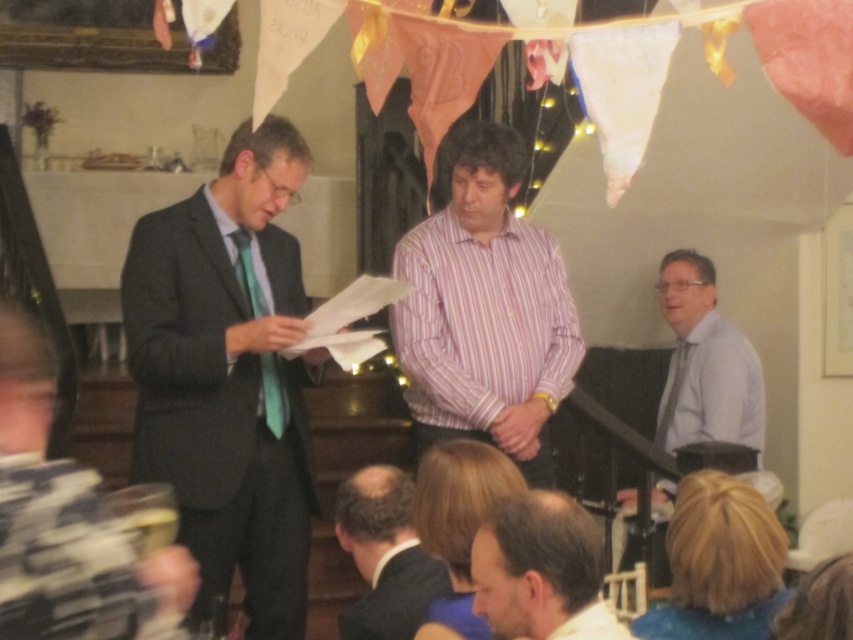
Question: Is dark gray suit at left to the left of matte white shirt at right from the viewer's perspective?

Choices:
 (A) no
 (B) yes

Answer: (B)

Question: Which object is the farthest from the dark brown hair at center?

Choices:
 (A) pink striped shirt at center
 (B) matte white shirt at right

Answer: (B)

Question: Is matte black suit at left below dark brown hair at center?

Choices:
 (A) yes
 (B) no

Answer: (B)

Question: Is matte black suit at left to the right of matte white shirt at right from the viewer's perspective?

Choices:
 (A) yes
 (B) no

Answer: (B)

Question: Which object is the farthest from the dark gray suit at left?

Choices:
 (A) matte black suit at left
 (B) green silk tie at center
 (C) dark brown hair at center

Answer: (A)

Question: Which object appears closest to the camera in this image?

Choices:
 (A) white silk tie at right
 (B) light brown hair at lower center
 (C) matte white shirt at right

Answer: (B)